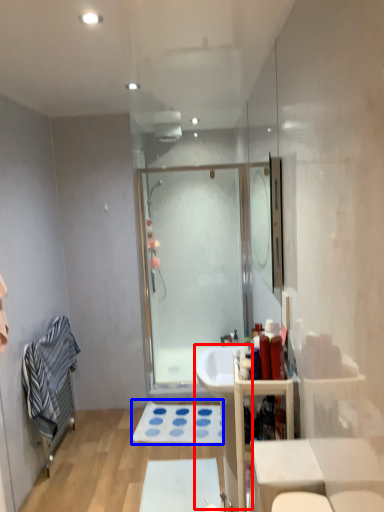
Question: Which object is further to the camera taking this photo, sink (highlighted by a red box) or bath mat (highlighted by a blue box)?

Choices:
 (A) sink
 (B) bath mat

Answer: (B)